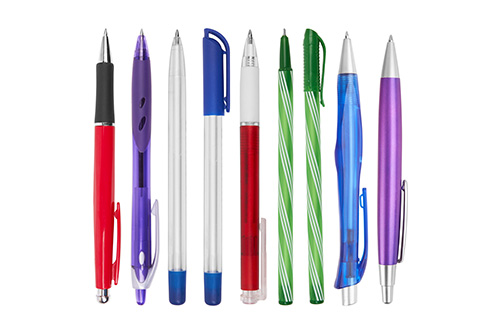
The width and height of the screenshot is (500, 333). Find the location of `pens`. pens is located at coordinates (107, 148), (151, 155), (188, 160), (214, 172), (249, 193), (277, 204), (319, 186), (353, 168), (382, 177).